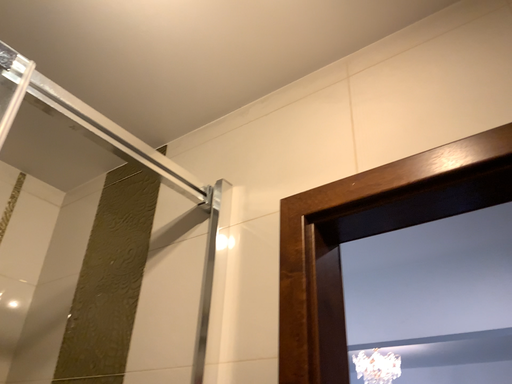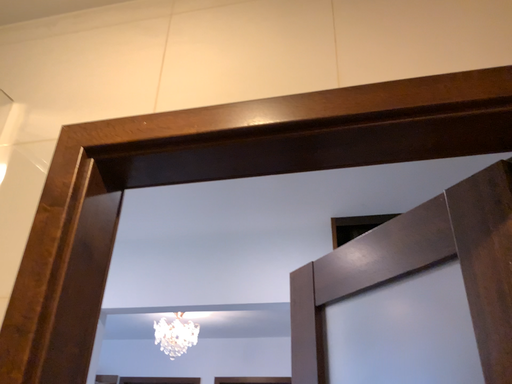
Question: Which way did the camera rotate in the video?

Choices:
 (A) rotated right
 (B) rotated left

Answer: (A)